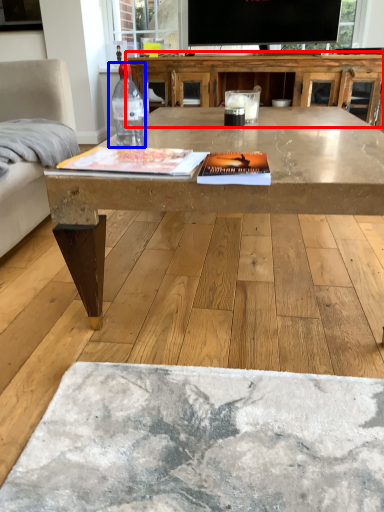
Question: Which of the following is the closest to the observer, table (highlighted by a red box) or bottle (highlighted by a blue box)?

Choices:
 (A) table
 (B) bottle

Answer: (B)